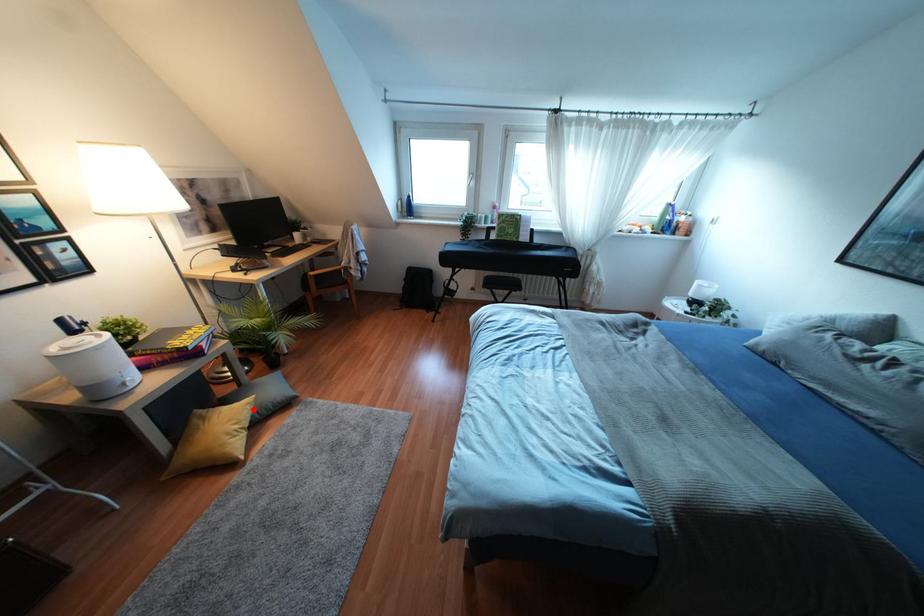
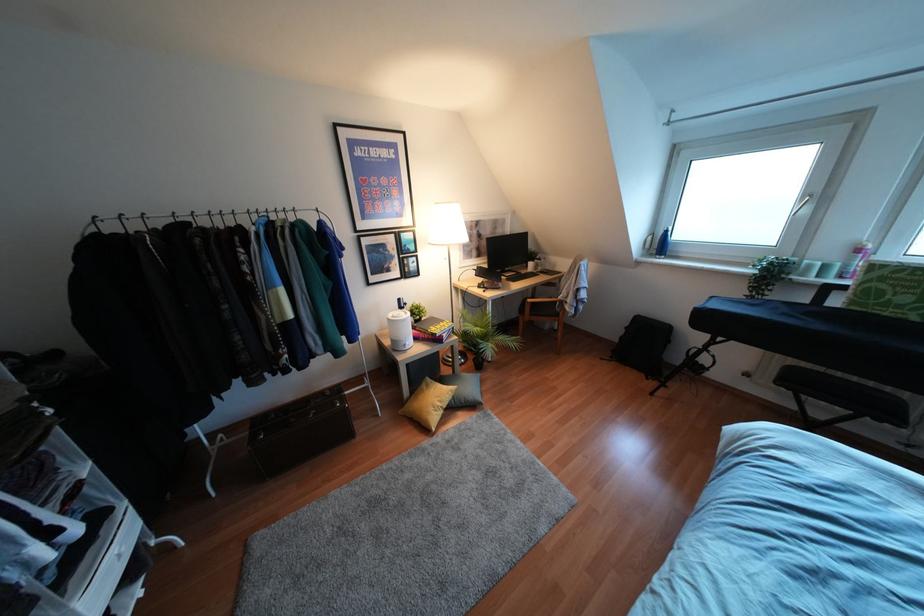
In the second image, find the point that corresponds to the highlighted location in the first image.

(453, 397)